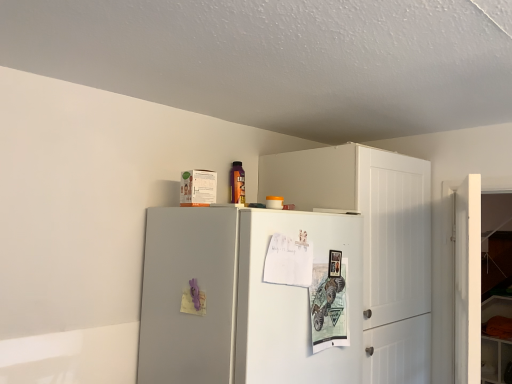
Question: Should I look upward or downward to see white matte door at right?

Choices:
 (A) down
 (B) up

Answer: (A)

Question: Is white matte cabinet at upper right to the left of white matte door at right from the viewer's perspective?

Choices:
 (A) yes
 (B) no

Answer: (A)

Question: Considering the relative sizes of white matte cabinet at upper right and white matte door at right in the image provided, is white matte cabinet at upper right thinner than white matte door at right?

Choices:
 (A) no
 (B) yes

Answer: (A)

Question: Is white matte cabinet at upper right not within white matte door at right?

Choices:
 (A) no
 (B) yes

Answer: (B)

Question: Is white matte cabinet at upper right facing away from white matte door at right?

Choices:
 (A) no
 (B) yes

Answer: (B)

Question: Is white matte cabinet at upper right with white matte door at right?

Choices:
 (A) no
 (B) yes

Answer: (A)

Question: From a real-world perspective, is white matte cabinet at upper right on white matte door at right?

Choices:
 (A) yes
 (B) no

Answer: (A)

Question: From a real-world perspective, is white matte cabinet at upper right physically above satin gray refrigerator at upper center?

Choices:
 (A) no
 (B) yes

Answer: (B)

Question: Is white matte cabinet at upper right thinner than satin gray refrigerator at upper center?

Choices:
 (A) yes
 (B) no

Answer: (A)

Question: Is satin gray refrigerator at upper center at the back of white matte cabinet at upper right?

Choices:
 (A) yes
 (B) no

Answer: (B)

Question: Is white matte cabinet at upper right not inside satin gray refrigerator at upper center?

Choices:
 (A) yes
 (B) no

Answer: (A)

Question: Considering the relative sizes of white matte cabinet at upper right and satin gray refrigerator at upper center in the image provided, is white matte cabinet at upper right smaller than satin gray refrigerator at upper center?

Choices:
 (A) no
 (B) yes

Answer: (A)

Question: Is white matte cabinet at upper right oriented towards satin gray refrigerator at upper center?

Choices:
 (A) yes
 (B) no

Answer: (B)

Question: Is white matte door at right taller than white matte cabinet at upper right?

Choices:
 (A) no
 (B) yes

Answer: (A)